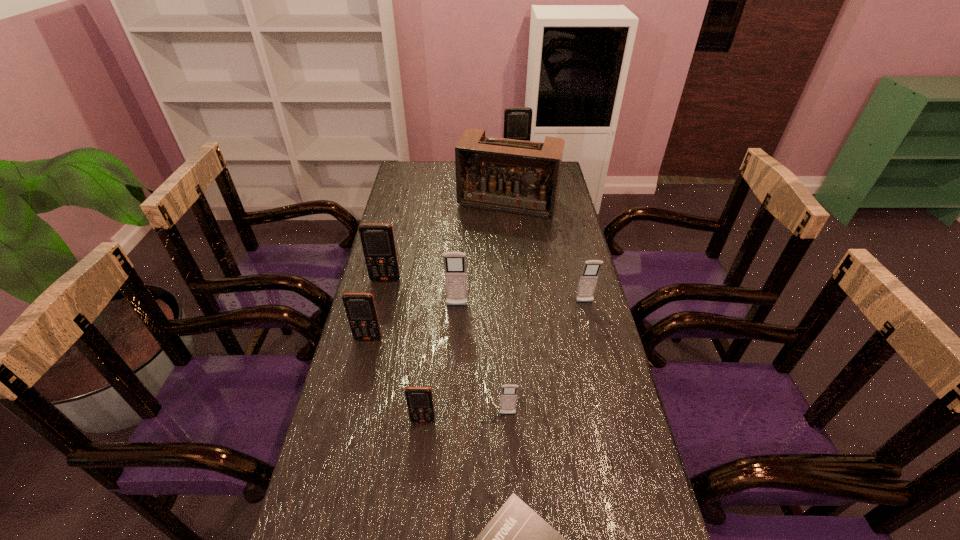
The image size is (960, 540). Identify the location of vacant space located 0.060m on the screen of the second nearest orange cellular telephone. (364, 359).

I want to click on vacant space situated on the screen of the nearest orange cellular telephone, so click(411, 536).

At what (x,y) coordinates should I click in order to perform the action: click on vacant region located 0.210m on the front-facing side of the third cellular telephone from right to left. Please return your answer as a coordinate pair (x, y). Looking at the image, I should click on (513, 507).

What are the coordinates of `cellular telephone at the far edge` in the screenshot? It's located at (517, 120).

Image resolution: width=960 pixels, height=540 pixels. I want to click on radio receiver that is at the far edge, so click(522, 177).

The image size is (960, 540). I want to click on radio receiver that is at the right edge, so click(x=522, y=177).

Locate an element on the screen. The width and height of the screenshot is (960, 540). cellular telephone that is at the far right corner is located at coordinates (517, 120).

Locate an element on the screen. The height and width of the screenshot is (540, 960). radio receiver located in the far right corner section of the desktop is located at coordinates (522, 177).

The image size is (960, 540). In the image, there is a desktop. Find the location of `vacant space at the far edge`. vacant space at the far edge is located at coordinates (454, 165).

Where is `vacant space at the left edge of the desktop`? The image size is (960, 540). vacant space at the left edge of the desktop is located at coordinates (391, 406).